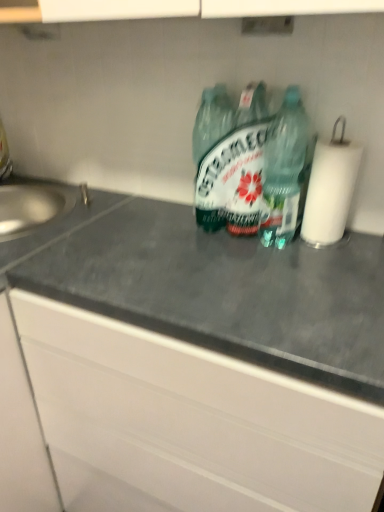
Locate an element on the screen. The width and height of the screenshot is (384, 512). free space to the left of white paper at right is located at coordinates (255, 253).